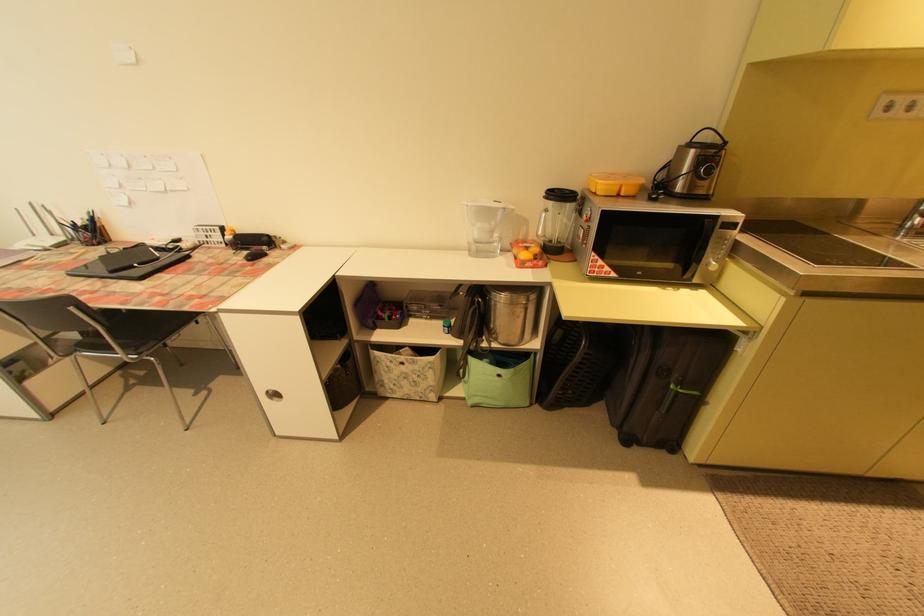
Find where to pull the white cabinet handle. Please return your answer as a coordinate pair (x, y).

(274, 394)